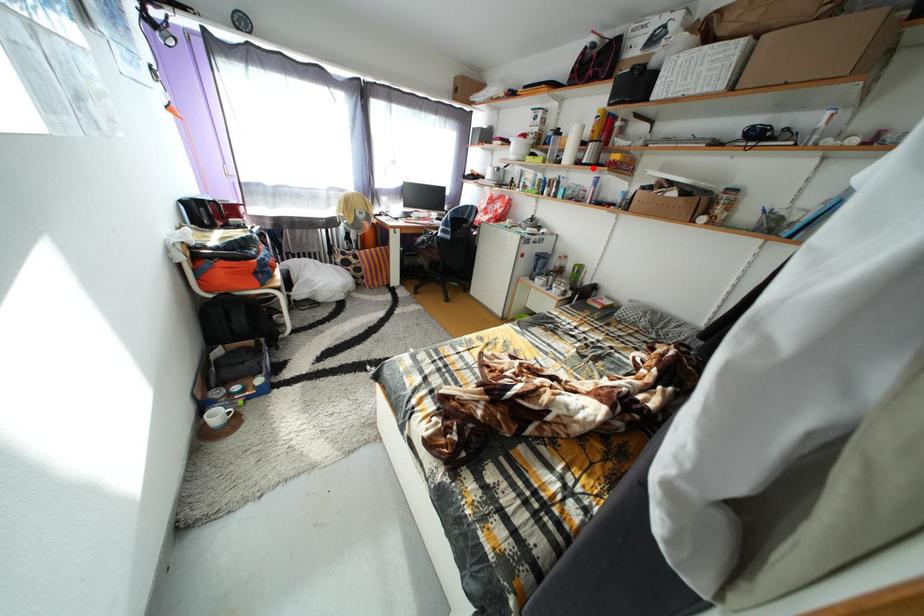
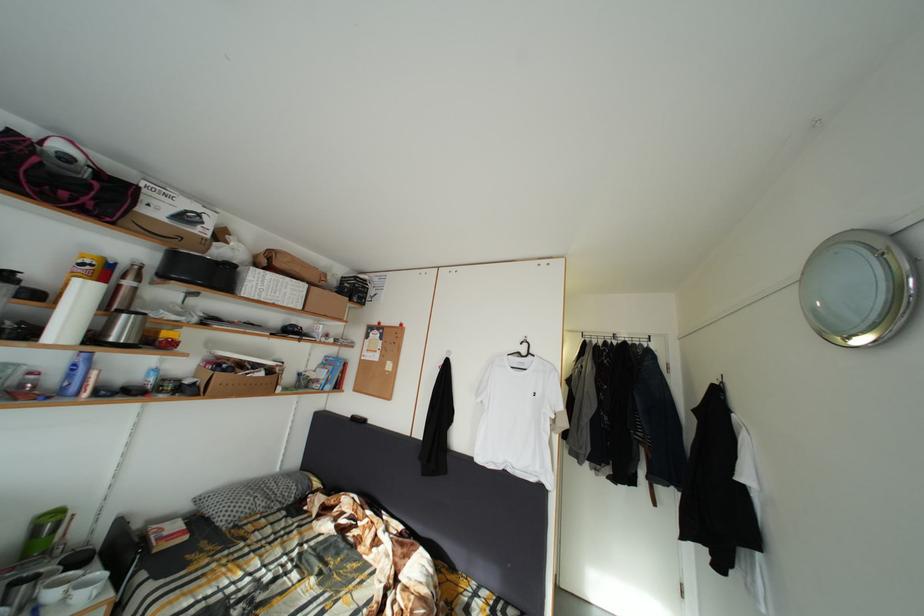
Question: A red point is marked in image1. In image2, is the corresponding 3D point closer to the camera or farther? Reply with the corresponding letter.

Choices:
 (A) The corresponding 3D point is closer.
 (B) The corresponding 3D point is farther.

Answer: (B)